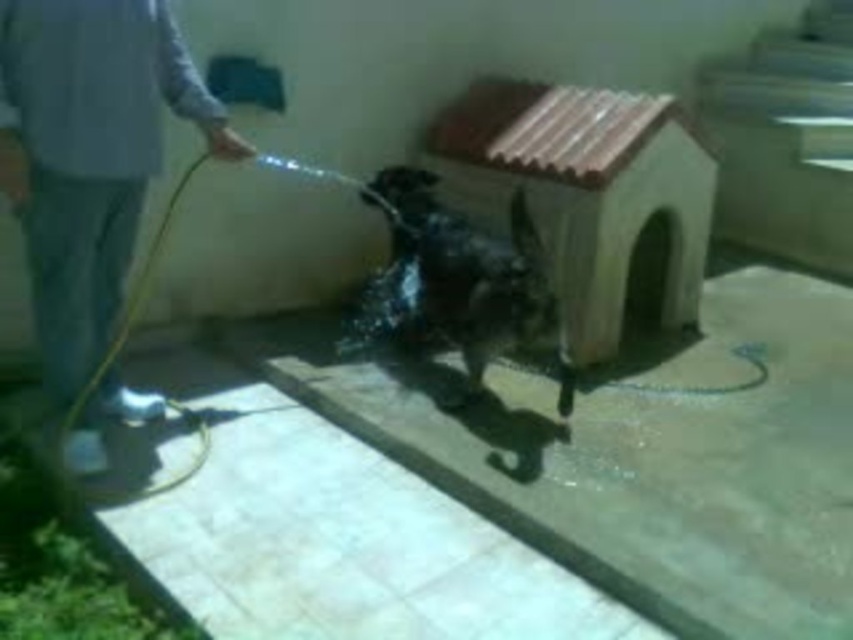
Question: Does gray fabric pants at lower left have a greater width compared to wet fur dog at center?

Choices:
 (A) no
 (B) yes

Answer: (A)

Question: Does gray fabric pants at lower left appear on the right side of wet fur dog at center?

Choices:
 (A) no
 (B) yes

Answer: (A)

Question: Considering the real-world distances, which object is farthest from the gray fabric pants at lower left?

Choices:
 (A) glossy plastic garden hose at lower left
 (B) wet fur dog at center

Answer: (B)

Question: Which of the following is the closest to the observer?

Choices:
 (A) (107, 113)
 (B) (511, 280)
 (C) (126, 493)

Answer: (C)

Question: Observing the image, what is the correct spatial positioning of wet fur dog at center in reference to glossy plastic garden hose at lower left?

Choices:
 (A) below
 (B) above

Answer: (B)

Question: Among these objects, which one is farthest from the camera?

Choices:
 (A) glossy plastic garden hose at lower left
 (B) wet fur dog at center

Answer: (B)